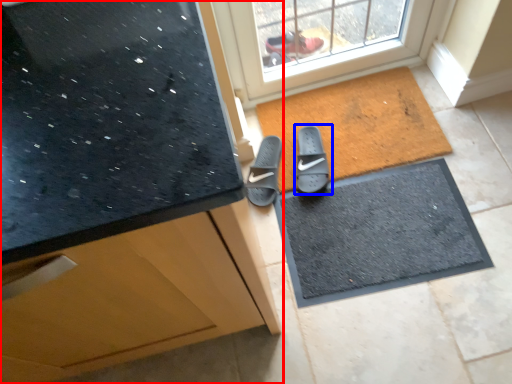
Question: Which object appears farthest to the camera in this image, cabinetry (highlighted by a red box) or footwear (highlighted by a blue box)?

Choices:
 (A) cabinetry
 (B) footwear

Answer: (B)